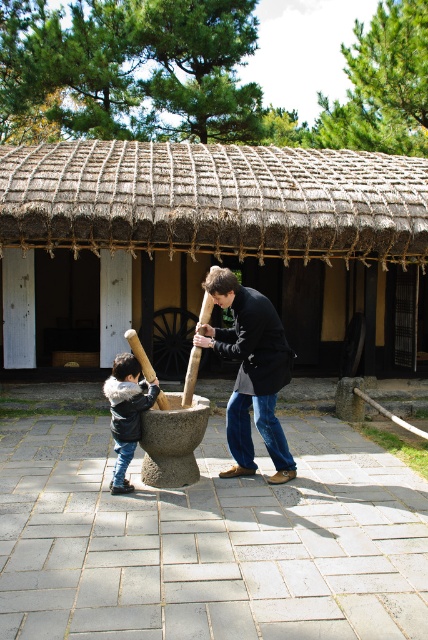
You are standing at the thatched roof structure and looking towards the two points marked in the image. Which point, point (395,288) or point (213,340), is closer to you?

Point (395,288) is further to the camera than point (213,340), so the closer point to you is point (213,340).

You are a visitor at this historical site and want to take a photo of the thatched straw hut at center and the dark brown leather jacket at center. Since you want both objects in the frame, which one should you focus on first to ensure they are both visible?

You should focus on the dark brown leather jacket at center first because the thatched straw hut at center is above it, so adjusting the camera angle downward will include both objects in the frame.